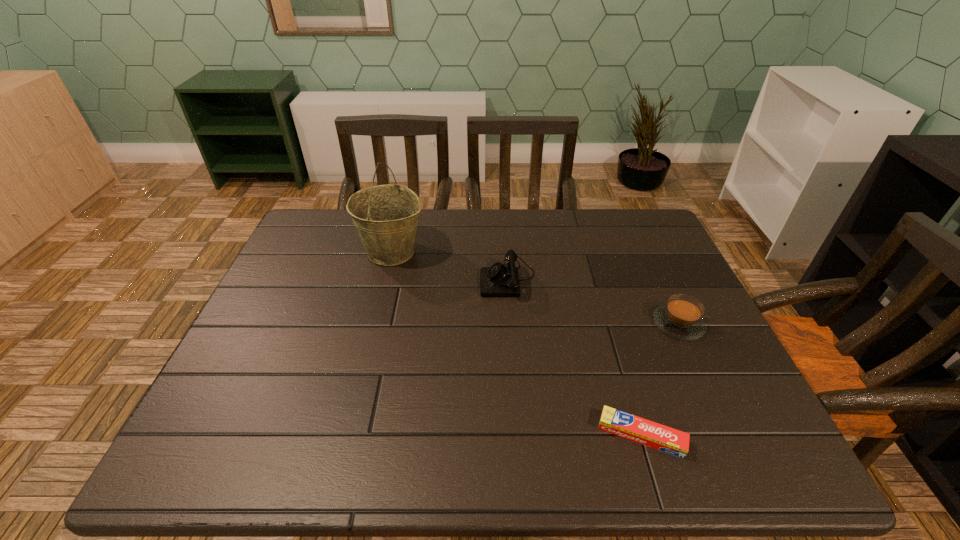
In the image, there is a desktop. Identify the location of free space at the right edge. The width and height of the screenshot is (960, 540). (641, 265).

The image size is (960, 540). Find the location of `blank space at the far left corner of the desktop`. blank space at the far left corner of the desktop is located at coordinates (297, 247).

At what (x,y) coordinates should I click in order to perform the action: click on vacant space at the far right corner of the desktop. Please return your answer as a coordinate pair (x, y). This screenshot has height=540, width=960. Looking at the image, I should click on (649, 246).

In the image, there is a desktop. Identify the location of vacant space at the near right corner. The height and width of the screenshot is (540, 960). (717, 456).

At what (x,y) coordinates should I click in order to perform the action: click on free point between the second object from right to left and the cappuccino. Please return your answer as a coordinate pair (x, y). Looking at the image, I should click on (660, 380).

Find the location of a particular element. The image size is (960, 540). free space between the wine bucket and the third shortest object is located at coordinates (450, 265).

This screenshot has width=960, height=540. Identify the location of unoccupied position between the cappuccino and the tallest object. (536, 288).

Locate an element on the screen. vacant region between the third farthest object and the second tallest object is located at coordinates (x=593, y=301).

Where is `free spot between the tallest object and the toothpaste`? This screenshot has width=960, height=540. free spot between the tallest object and the toothpaste is located at coordinates (516, 343).

At what (x,y) coordinates should I click in order to perform the action: click on vacant region between the leftmost object and the third farthest object. Please return your answer as a coordinate pair (x, y). Looking at the image, I should click on (536, 288).